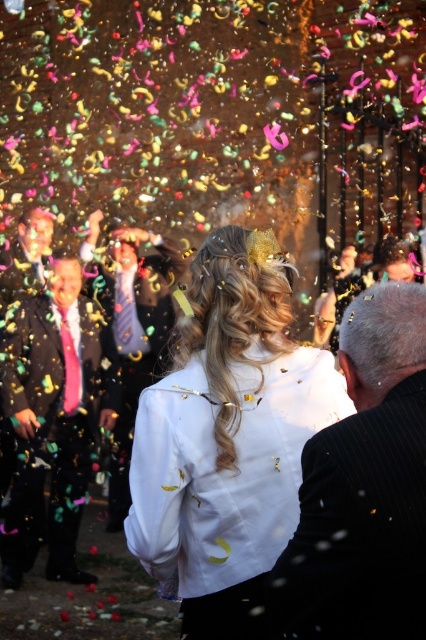
Question: Can you confirm if white satin dress at center is positioned below matte black suit at left?

Choices:
 (A) no
 (B) yes

Answer: (B)

Question: Which point is farther to the camera?

Choices:
 (A) (422, 424)
 (B) (163, 468)
 (C) (100, 406)

Answer: (C)

Question: Is white satin dress at center behind black pinstripe suit at right?

Choices:
 (A) no
 (B) yes

Answer: (B)

Question: Which of the following is the closest to the observer?

Choices:
 (A) (258, 509)
 (B) (319, 561)

Answer: (B)

Question: Which point appears closest to the camera in this image?

Choices:
 (A) (365, 321)
 (B) (112, 298)
 (C) (236, 404)
 (D) (28, 440)

Answer: (A)

Question: Is shiny pink tie at left wider than matte black suit at left?

Choices:
 (A) no
 (B) yes

Answer: (A)